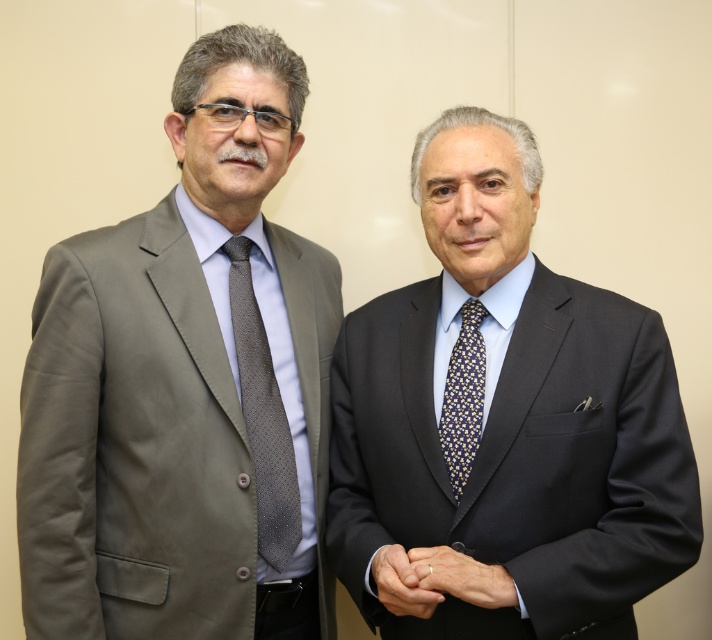
Question: Observing the image, what is the correct spatial positioning of gray dotted tie at left in reference to gold textured ring at center?

Choices:
 (A) above
 (B) below

Answer: (A)

Question: Among these points, which one is nearest to the camera?

Choices:
 (A) (441, 449)
 (B) (337, 419)
 (C) (115, 477)

Answer: (A)

Question: Can you confirm if matte gray suit at left is wider than gray dotted tie at left?

Choices:
 (A) no
 (B) yes

Answer: (B)

Question: Which of these objects is positioned farthest from the gold metallic ring at center?

Choices:
 (A) gold textured ring at center
 (B) dark blue textured suit at center

Answer: (B)

Question: Observing the image, what is the correct spatial positioning of matte gray suit at left in reference to gold metallic ring at center?

Choices:
 (A) below
 (B) above

Answer: (B)

Question: Which object is the closest to the gold textured ring at center?

Choices:
 (A) gold metallic ring at center
 (B) matte gray suit at left
 (C) gray dotted tie at left

Answer: (A)